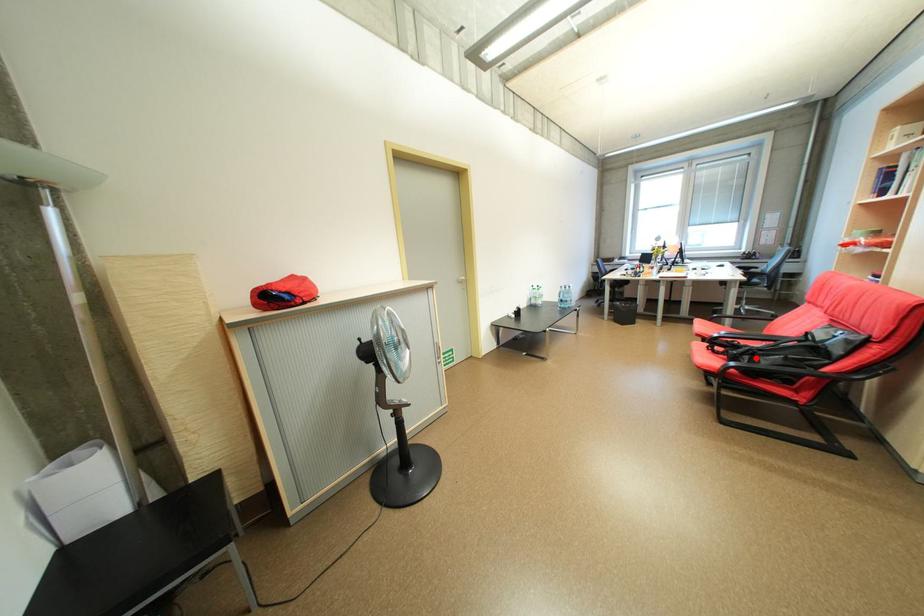
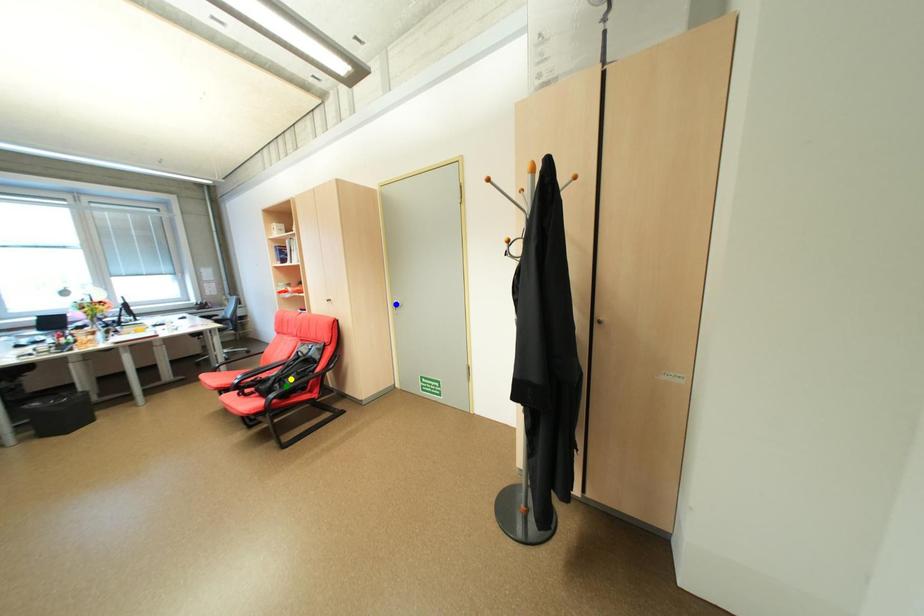
Question: I am providing you with two images of the same scene from different viewpoints. A red point is marked on the first image. You are given multiple points on the second image. Which point in image 2 is actually the same real-world point as the red point in image 1?

Choices:
 (A) yellow point
 (B) blue point
 (C) green point

Answer: (C)